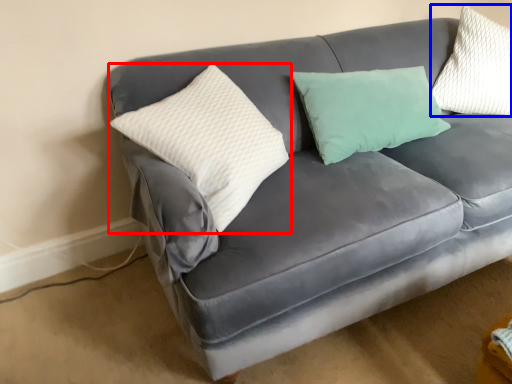
Question: Which point is further to the camera, pillow (highlighted by a red box) or pillow (highlighted by a blue box)?

Choices:
 (A) pillow
 (B) pillow

Answer: (B)